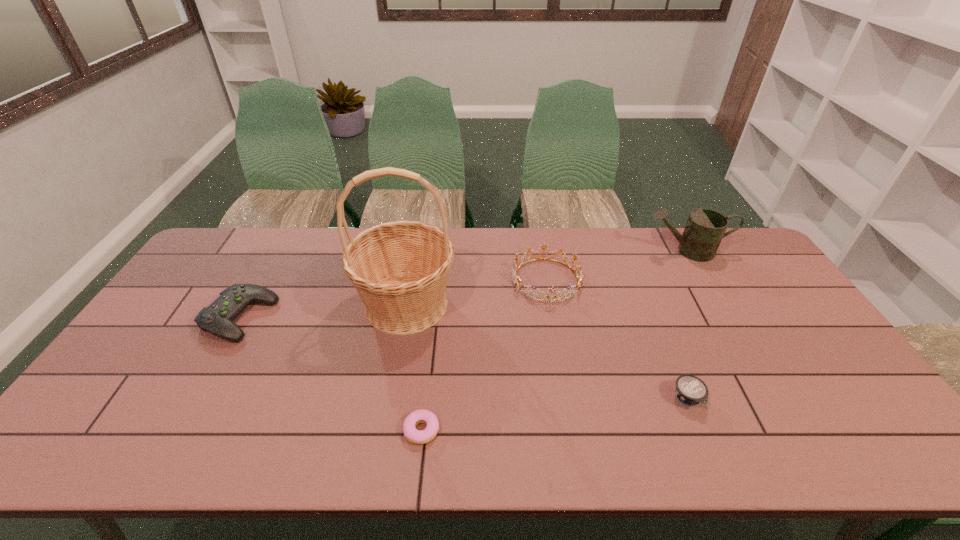
Identify the location of vacant area situated 0.070m on the front of the tallest object. The height and width of the screenshot is (540, 960). (396, 363).

Where is `blank area located 0.150m with the spout on the watering can`? The height and width of the screenshot is (540, 960). blank area located 0.150m with the spout on the watering can is located at coordinates (601, 251).

Find the location of a particular element. vacant space located 0.110m with the spout on the watering can is located at coordinates (612, 251).

This screenshot has width=960, height=540. I want to click on free space located 0.360m with the spout on the watering can, so click(541, 251).

Where is `free space located on the front-facing side of the fourth object from left to right`? free space located on the front-facing side of the fourth object from left to right is located at coordinates (568, 406).

Where is `vacant space situated on the back of the leftmost object`? The image size is (960, 540). vacant space situated on the back of the leftmost object is located at coordinates (289, 231).

Find the location of a particular element. The width and height of the screenshot is (960, 540). vacant area situated 0.130m on the back of the fifth tallest object is located at coordinates (665, 346).

Find the location of a particular element. vacant region located 0.310m on the right of the shortest object is located at coordinates [572, 430].

At what (x,y) coordinates should I click in order to perform the action: click on watering can positioned at the far edge. Please return your answer as a coordinate pair (x, y). The image size is (960, 540). Looking at the image, I should click on (705, 228).

Identify the location of tiara positioned at the far edge. (516, 279).